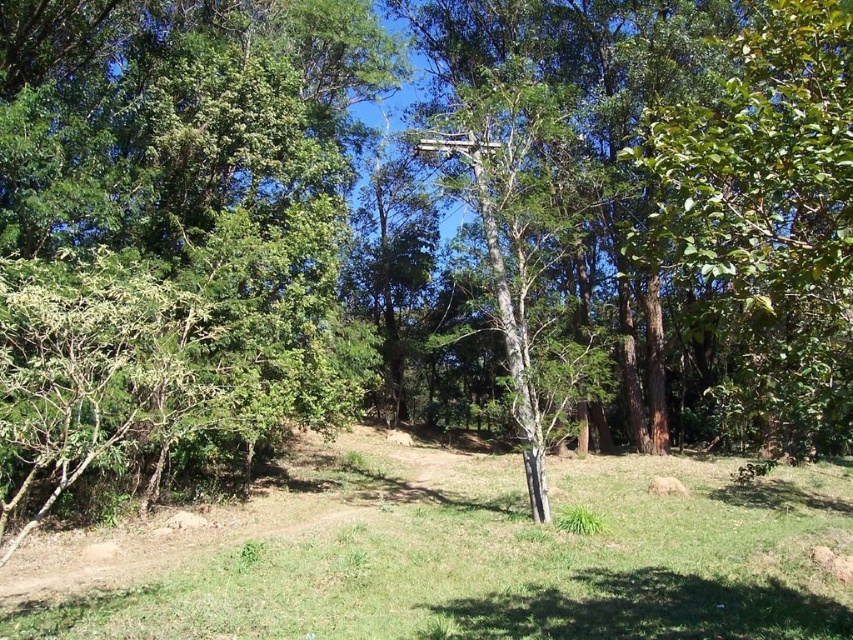
Question: Does green grassy at center appear on the left side of white smooth birch tree at center?

Choices:
 (A) no
 (B) yes

Answer: (B)

Question: Which point is farther to the camera?

Choices:
 (A) (659, 588)
 (B) (526, 262)

Answer: (B)

Question: Can you confirm if green grassy at center is positioned to the right of white smooth birch tree at center?

Choices:
 (A) yes
 (B) no

Answer: (B)

Question: Is green grassy at center to the left of white smooth birch tree at center from the viewer's perspective?

Choices:
 (A) no
 (B) yes

Answer: (B)